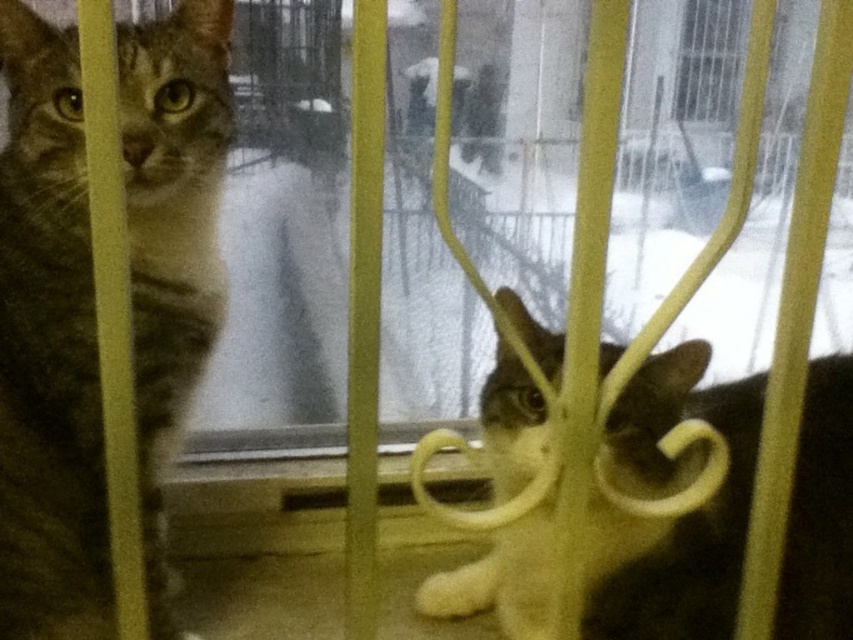
You are observing two cats in an indoor setting. There is a tabby fur cat at left and a dark brown fur cat at center. Which cat is positioned to the right of the other?

The dark brown fur cat at center is positioned to the right of the tabby fur cat at left.

You are an animal caretaker in a shelter and need to identify the location of the tabby fur cat at left relative to the yellow metal railing. Based on the coordinates provided, is the cat in front of or behind the railing?

The tabby fur cat at left is located at point (48, 349), which places it in front of the yellow metal railing since its coordinates indicate a position closer to the viewer compared to the railing in the background.

From the picture: You are standing in front of the image and want to touch the point at coordinates point (12,81). Given that your hand can reach up to 30 inches, can you reach that point without moving your position?

The point (12,81) is 34.78 inches from the viewer, which is beyond your hand reach of 30 inches. You cannot reach it without moving.